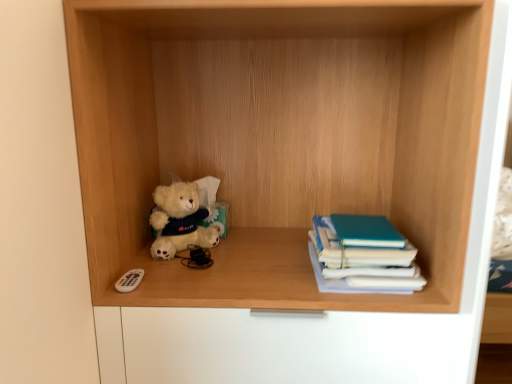
This screenshot has height=384, width=512. What do you see at coordinates (364, 255) in the screenshot?
I see `teal matte book at right` at bounding box center [364, 255].

Image resolution: width=512 pixels, height=384 pixels. Find the location of `teal matte book at right`. teal matte book at right is located at coordinates (364, 255).

From a real-world perspective, does teal matte book at right stand above white plastic remote control at lower left?

Yes, from a real-world perspective, teal matte book at right is above white plastic remote control at lower left.

Considering the sizes of objects teal matte book at right and white plastic remote control at lower left in the image provided, who is thinner, teal matte book at right or white plastic remote control at lower left?

Thinner between the two is white plastic remote control at lower left.

In the scene shown: How different are the orientations of teal matte book at right and white plastic remote control at lower left in degrees?

2.03 degrees.

Is teal matte book at right turned away from white plastic remote control at lower left?

No.

Where is `toy that is in front of the fluffy white teddy bear at center-left`? The width and height of the screenshot is (512, 384). toy that is in front of the fluffy white teddy bear at center-left is located at coordinates (129, 280).

Does white plastic remote control at lower left have a greater width compared to fluffy white teddy bear at center-left?

Correct, the width of white plastic remote control at lower left exceeds that of fluffy white teddy bear at center-left.

Considering the positions of points (122, 280) and (193, 208), is point (122, 280) closer to camera compared to point (193, 208)?

Yes, it is in front of point (193, 208).

Is white plastic remote control at lower left positioned in front of fluffy white teddy bear at center-left?

Yes, the depth of white plastic remote control at lower left is less than that of fluffy white teddy bear at center-left.

Which is behind, point (162, 211) or point (118, 281)?

The point (162, 211) is farther.

In the image, there is a white plastic remote control at lower left. Where is `teddy bear above it (from the image's perspective)`? teddy bear above it (from the image's perspective) is located at coordinates (180, 220).

Is fluffy white teddy bear at center-left inside the boundaries of white plastic remote control at lower left, or outside?

fluffy white teddy bear at center-left is not enclosed by white plastic remote control at lower left.

Does fluffy white teddy bear at center-left appear on the right side of white plastic remote control at lower left?

Yes.

Does white plastic remote control at lower left appear on the right side of wooden shelf at center?

In fact, white plastic remote control at lower left is to the left of wooden shelf at center.

How much distance is there between white plastic remote control at lower left and wooden shelf at center?

white plastic remote control at lower left is 22.13 inches from wooden shelf at center.

From the image's perspective, between white plastic remote control at lower left and wooden shelf at center, which one is located above?

From the image's view, wooden shelf at center is above.

Which is in front, point (122, 279) or point (289, 26)?

The point (122, 279) is closer to the camera.

Can you see wooden shelf at center touching teal matte book at right?

No.

From a real-world perspective, is wooden shelf at center on teal matte book at right?

Yes, from a real-world perspective, wooden shelf at center is above teal matte book at right.

This screenshot has height=384, width=512. What are the coordinates of `shelf above the teal matte book at right (from the image's perspective)` in the screenshot? It's located at (280, 137).

Is wooden shelf at center closer to camera compared to teal matte book at right?

Yes, it is in front of teal matte book at right.

From the image's perspective, is wooden shelf at center above or below fluffy white teddy bear at center-left?

wooden shelf at center is situated higher than fluffy white teddy bear at center-left in the image.

Could you tell me if wooden shelf at center is turned towards fluffy white teddy bear at center-left?

Yes, wooden shelf at center is oriented towards fluffy white teddy bear at center-left.

From a real-world perspective, who is located higher, wooden shelf at center or fluffy white teddy bear at center-left?

From a 3D spatial view, wooden shelf at center is above.

Considering the sizes of objects wooden shelf at center and fluffy white teddy bear at center-left in the image provided, who is shorter, wooden shelf at center or fluffy white teddy bear at center-left?

Standing shorter between the two is fluffy white teddy bear at center-left.

How different are the orientations of teal matte book at right and fluffy white teddy bear at center-left in degrees?

40.4 degrees.

This screenshot has height=384, width=512. Find the location of `book below the fluffy white teddy bear at center-left (from the image's perspective)`. book below the fluffy white teddy bear at center-left (from the image's perspective) is located at coordinates (364, 255).

From a real-world perspective, is teal matte book at right physically below fluffy white teddy bear at center-left?

Yes.

Between teal matte book at right and fluffy white teddy bear at center-left, which one has smaller width?

With smaller width is fluffy white teddy bear at center-left.

The width and height of the screenshot is (512, 384). Identify the location of book above the white plastic remote control at lower left (from a real-world perspective). (364, 255).

Locate an element on the screen. teddy bear on the right of white plastic remote control at lower left is located at coordinates (180, 220).

From the image, which object appears to be nearer to white plastic remote control at lower left, wooden shelf at center or teal matte book at right?

The object closer to white plastic remote control at lower left is teal matte book at right.

Which object lies nearer to the anchor point white plastic remote control at lower left, teal matte book at right or fluffy white teddy bear at center-left?

fluffy white teddy bear at center-left is closer to white plastic remote control at lower left.

Looking at the image, which one is located closer to teal matte book at right, fluffy white teddy bear at center-left or wooden shelf at center?

wooden shelf at center lies closer to teal matte book at right than the other object.

Looking at the image, which one is located further to wooden shelf at center, fluffy white teddy bear at center-left or white plastic remote control at lower left?

white plastic remote control at lower left lies further to wooden shelf at center than the other object.

Which object lies further to the anchor point teal matte book at right, fluffy white teddy bear at center-left or white plastic remote control at lower left?

white plastic remote control at lower left lies further to teal matte book at right than the other object.

Estimate the real-world distances between objects in this image. Which object is further from white plastic remote control at lower left, wooden shelf at center or fluffy white teddy bear at center-left?

Result: wooden shelf at center is further to white plastic remote control at lower left.

Which object lies further to the anchor point teal matte book at right, wooden shelf at center or white plastic remote control at lower left?

Among the two, white plastic remote control at lower left is located further to teal matte book at right.

Based on their spatial positions, is fluffy white teddy bear at center-left or teal matte book at right closer to wooden shelf at center?

Based on the image, teal matte book at right appears to be nearer to wooden shelf at center.

The width and height of the screenshot is (512, 384). I want to click on shelf between white plastic remote control at lower left and teal matte book at right from left to right, so click(280, 137).

Where is `teddy bear located between white plastic remote control at lower left and wooden shelf at center in the left-right direction`? The height and width of the screenshot is (384, 512). teddy bear located between white plastic remote control at lower left and wooden shelf at center in the left-right direction is located at coordinates (180, 220).

At what (x,y) coordinates should I click in order to perform the action: click on teddy bear between white plastic remote control at lower left and teal matte book at right. Please return your answer as a coordinate pair (x, y). The width and height of the screenshot is (512, 384). Looking at the image, I should click on coord(180,220).

Locate an element on the screen. Image resolution: width=512 pixels, height=384 pixels. shelf situated between fluffy white teddy bear at center-left and teal matte book at right from left to right is located at coordinates (280, 137).